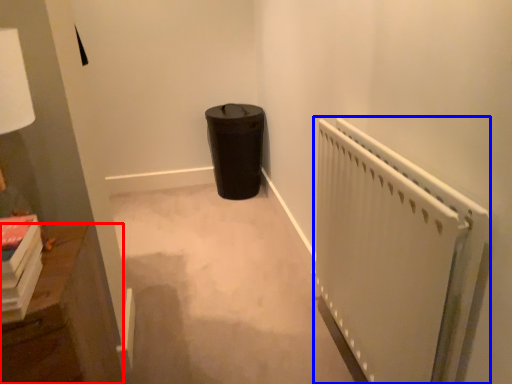
Question: Which of the following is the closest to the observer, furniture (highlighted by a red box) or radiator (highlighted by a blue box)?

Choices:
 (A) furniture
 (B) radiator

Answer: (B)